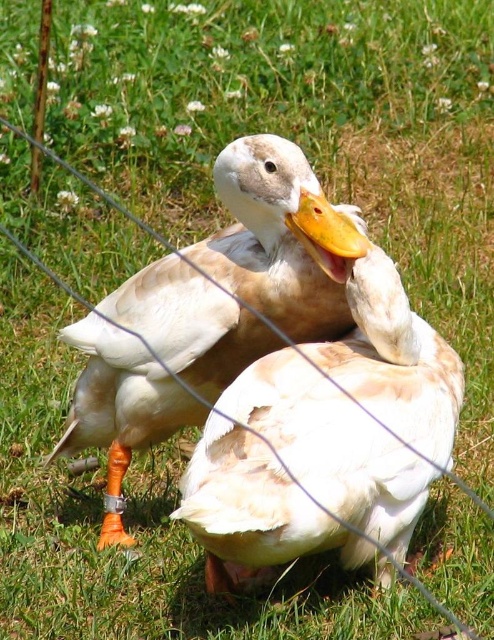
Question: Estimate the real-world distances between objects in this image. Which object is farther from the white feathered goose at center?

Choices:
 (A) yellow matte beak at center
 (B) white matte duck at center

Answer: (B)

Question: Which object is positioned closest to the white matte duck at center?

Choices:
 (A) yellow matte beak at center
 (B) white feathered goose at center

Answer: (B)

Question: Where is white matte duck at center located in relation to white feathered goose at center in the image?

Choices:
 (A) right
 (B) left

Answer: (A)

Question: Considering the real-world distances, which object is closest to the white feathered goose at center?

Choices:
 (A) white matte duck at center
 (B) yellow matte beak at center

Answer: (B)

Question: Is white matte duck at center bigger than yellow matte beak at center?

Choices:
 (A) no
 (B) yes

Answer: (B)

Question: Can you confirm if white matte duck at center is smaller than yellow matte beak at center?

Choices:
 (A) yes
 (B) no

Answer: (B)